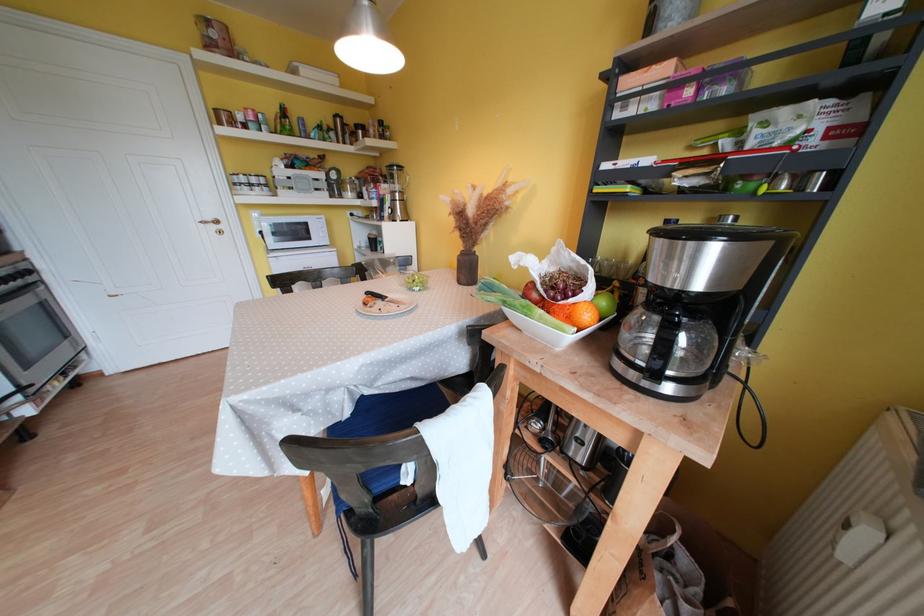
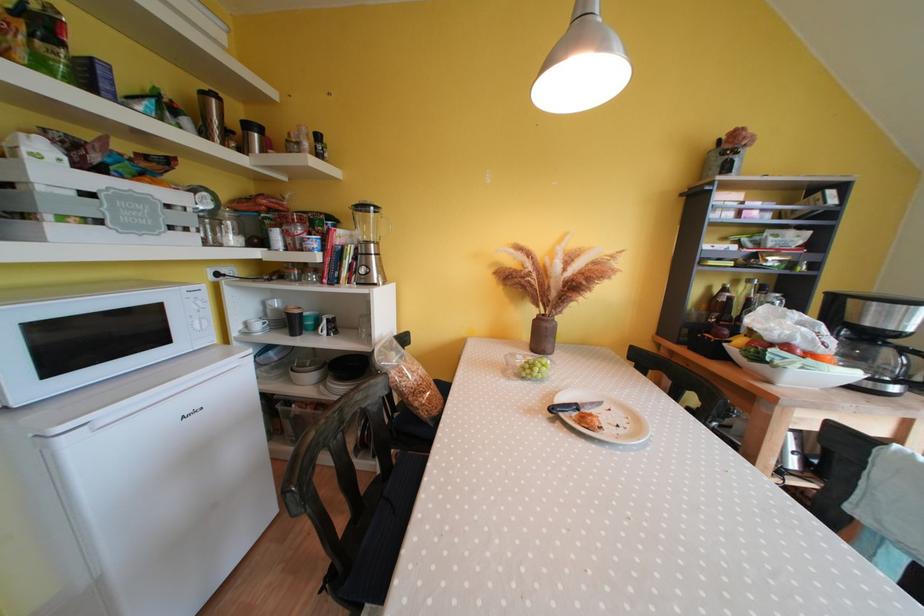
Find the pixel in the second image that matches (x=396, y=262) in the first image.

(397, 345)